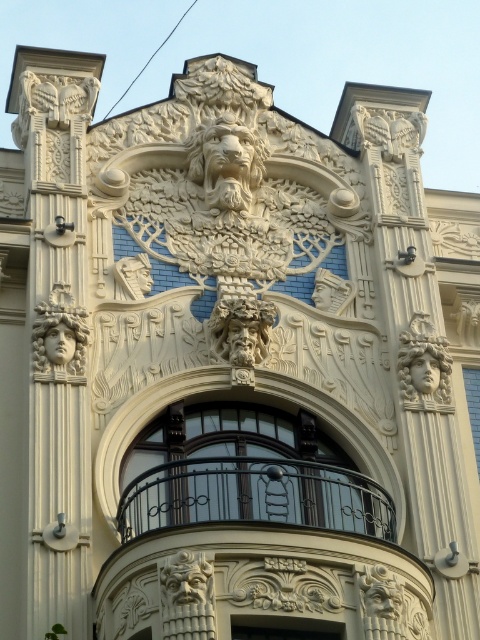
Question: Which object is closer to the camera taking this photo?

Choices:
 (A) matte white statue at lower left
 (B) matte white mask at lower right
 (C) matte stone head at center
 (D) white stone face at left

Answer: (B)

Question: Can you confirm if smooth wooden door at center is thinner than matte white mask at lower right?

Choices:
 (A) no
 (B) yes

Answer: (A)

Question: Based on their relative distances, which object is farther from the white stone face at left?

Choices:
 (A) black wrought iron balcony at center
 (B) matte stone face at center

Answer: (A)

Question: Does matte stone head at center appear on the right side of smooth wooden door at center?

Choices:
 (A) yes
 (B) no

Answer: (B)

Question: Observing the image, what is the correct spatial positioning of white stone face at left in reference to smooth wooden door at center?

Choices:
 (A) left
 (B) right

Answer: (A)

Question: Estimate the real-world distances between objects in this image. Which object is closer to the matte stone head at center?

Choices:
 (A) black wrought iron balcony at center
 (B) smooth wooden door at center
 (C) white stone face at left

Answer: (C)